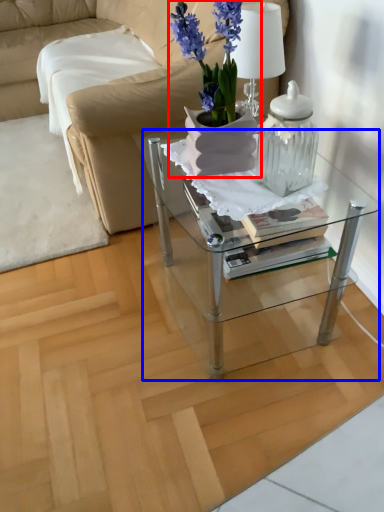
Question: Which object appears farthest to the camera in this image, houseplant (highlighted by a red box) or table (highlighted by a blue box)?

Choices:
 (A) houseplant
 (B) table

Answer: (B)